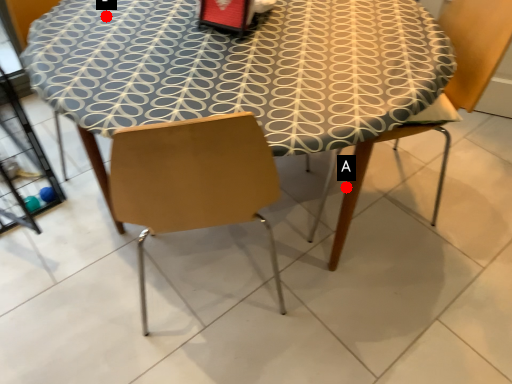
Question: Two points are circled on the image, labeled by A and B beside each circle. Which point is farther to the camera?

Choices:
 (A) A is further
 (B) B is further

Answer: (B)